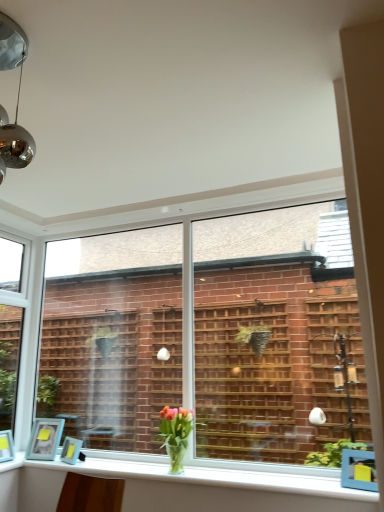
Image resolution: width=384 pixels, height=512 pixels. Find the location of `vacant space underneath translucent glass vase at lower center (from a real-world perspective)`. vacant space underneath translucent glass vase at lower center (from a real-world perspective) is located at coordinates (185, 469).